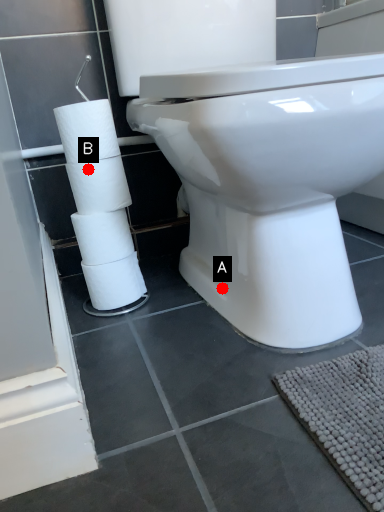
Question: Two points are circled on the image, labeled by A and B beside each circle. Which point is closer to the camera taking this photo?

Choices:
 (A) A is closer
 (B) B is closer

Answer: (B)